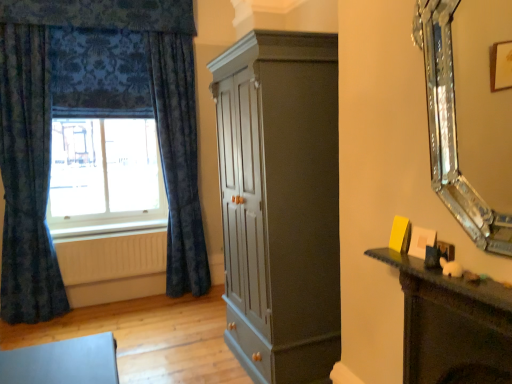
Question: Does silver/glass mirror at right have a greater height compared to wooden radiator at lower left?

Choices:
 (A) yes
 (B) no

Answer: (A)

Question: Can you confirm if silver/glass mirror at right is thinner than wooden radiator at lower left?

Choices:
 (A) no
 (B) yes

Answer: (A)

Question: Is silver/glass mirror at right beside wooden radiator at lower left?

Choices:
 (A) yes
 (B) no

Answer: (B)

Question: Can you confirm if silver/glass mirror at right is positioned to the right of wooden radiator at lower left?

Choices:
 (A) yes
 (B) no

Answer: (A)

Question: From the image's perspective, is silver/glass mirror at right above wooden radiator at lower left?

Choices:
 (A) yes
 (B) no

Answer: (A)

Question: Can wooden radiator at lower left be found inside silver/glass mirror at right?

Choices:
 (A) no
 (B) yes

Answer: (A)

Question: Is velvety blue curtain at left, which is the 2th curtain from left to right, located within wooden radiator at lower left?

Choices:
 (A) yes
 (B) no

Answer: (B)

Question: Is wooden radiator at lower left at the right side of velvety blue curtain at left, the first curtain viewed from the right?

Choices:
 (A) no
 (B) yes

Answer: (A)

Question: From a real-world perspective, is wooden radiator at lower left on velvety blue curtain at left, which is the 2th curtain from left to right?

Choices:
 (A) no
 (B) yes

Answer: (A)

Question: Can you confirm if wooden radiator at lower left is positioned to the left of velvety blue curtain at left, which is the 2th curtain from left to right?

Choices:
 (A) no
 (B) yes

Answer: (B)

Question: Is wooden radiator at lower left oriented away from velvety blue curtain at left, the first curtain viewed from the right?

Choices:
 (A) yes
 (B) no

Answer: (B)

Question: Is wooden radiator at lower left placed right next to velvety blue curtain at left, which is the 2th curtain from left to right?

Choices:
 (A) yes
 (B) no

Answer: (B)

Question: Is white wood at lower left at the right side of blue velvet curtains at left?

Choices:
 (A) no
 (B) yes

Answer: (B)